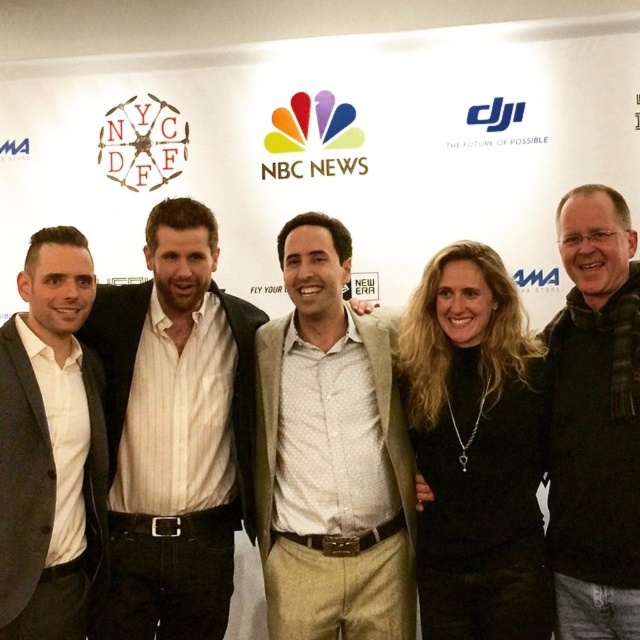
Is point (470, 413) farther from viewer compared to point (67, 458)?

Yes.

Where is `black matte dress at center`? black matte dress at center is located at coordinates (474, 451).

Which is in front, point (205, 404) or point (483, 285)?

Point (483, 285) is in front.

Is white striped shirt at center shorter than black matte dress at center?

No.

Is point (200, 625) less distant than point (525, 518)?

That is False.

The height and width of the screenshot is (640, 640). I want to click on white striped shirt at center, so click(x=173, y=432).

Which is more to the left, white striped shirt at center or white matte suit at left?

white matte suit at left is more to the left.

Who is more forward, (172, 296) or (60, 627)?

Point (60, 627)

At what (x,y) coordinates should I click in order to perform the action: click on white striped shirt at center. Please return your answer as a coordinate pair (x, y). This screenshot has width=640, height=640. Looking at the image, I should click on (173, 432).